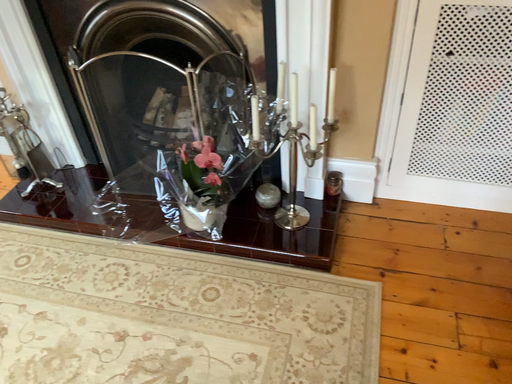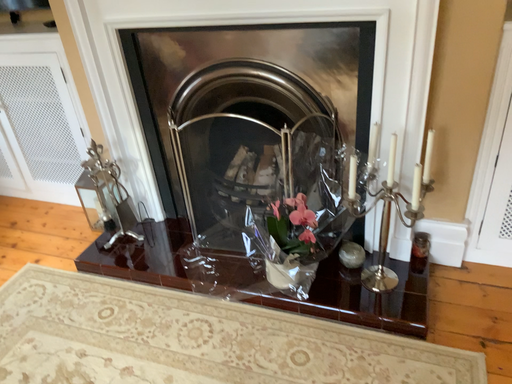
Question: Which way did the camera rotate in the video?

Choices:
 (A) rotated upward
 (B) rotated downward

Answer: (A)